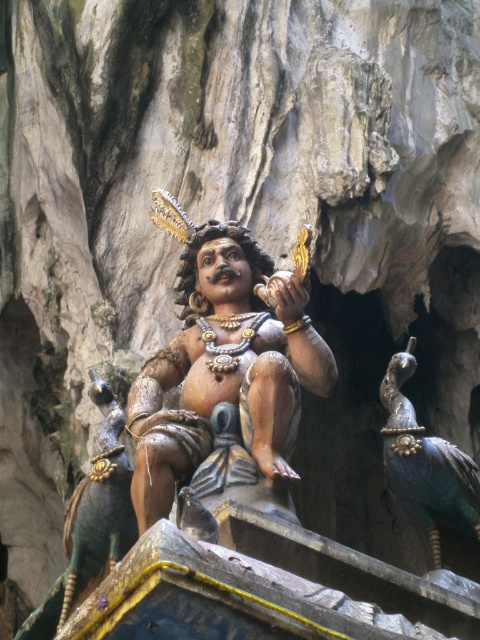
You are an art curator planning to display both the polished bronze statue at center and the shiny green peacock at center in a gallery. Based on their sizes, which object should be placed in a more prominent location to highlight its presence?

The polished bronze statue at center is larger than the shiny green peacock at center, so it should be placed in a more prominent location to highlight its presence.

You are an art curator planning to display both the polished bronze statue at center and the shiny teal peacock at right in a new exhibition. Given their sizes, which object should be placed on a higher pedestal to ensure both are visible from the front row of the exhibition hall?

The polished bronze statue at center is taller than the shiny teal peacock at right, so it should be placed on a lower pedestal to ensure both are visible from the front row. Conversely, the shorter shiny teal peacock at right can be placed on a higher pedestal to balance their overall heights and maintain visibility.

You are standing in front of the statue and want to take a photo of the shiny teal peacock at right. Where should you look to capture it in your camera frame?

The shiny teal peacock at right is located at the 2D coordinates point (x=425, y=465), so you should aim your camera towards that position to capture it.